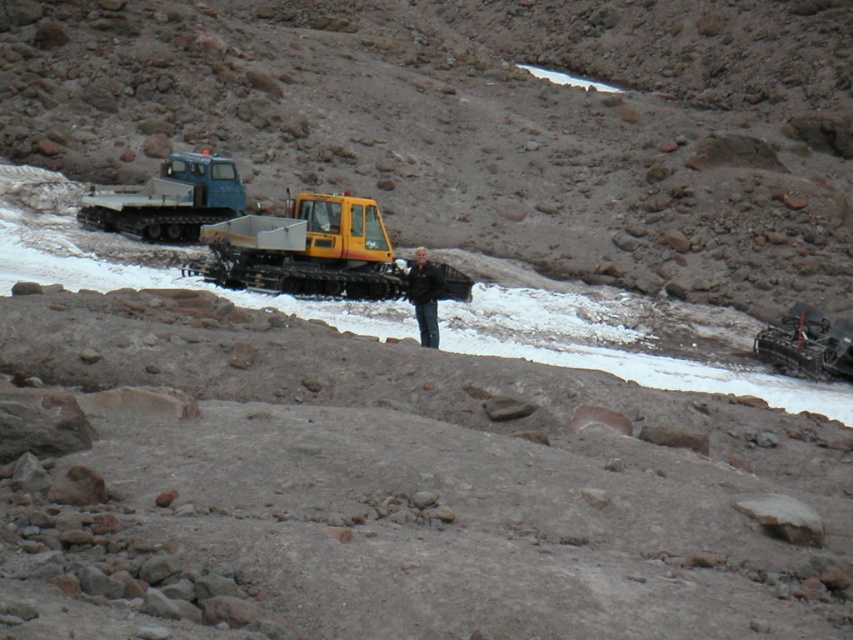
You are a rescue worker in a snowy area. You see a blue rubber tracked vehicle at left and a black matte jacket at center. Which object is bigger?

The blue rubber tracked vehicle at left is larger in size than the black matte jacket at center.

You are a snowplow operator standing near the blue rubber tracked vehicle at left. You need to reach the black matte jacket at center to deliver a tool. Can you walk directly to them without moving the vehicle?

The black matte jacket at center is behind the blue rubber tracked vehicle at left, so you cannot walk directly to them without moving the vehicle.

You are standing at point (201, 188) and want to walk to point (422, 324). Is there any obstacle between these two points in the scene?

There are no obstacles between point (201, 188) and point (422, 324) because the scene description mentions a large yellow tracked vehicle parked on the snow in the foreground, a partially visible tracked vehicle to the left, and a person near the center. The coordinates suggest point (201, 188) is behind point (422, 324), so the path might be clear unless blocked by the vehicles or the person. However, the objects description states point (201, 188) is behind point (422, 324), implying they are